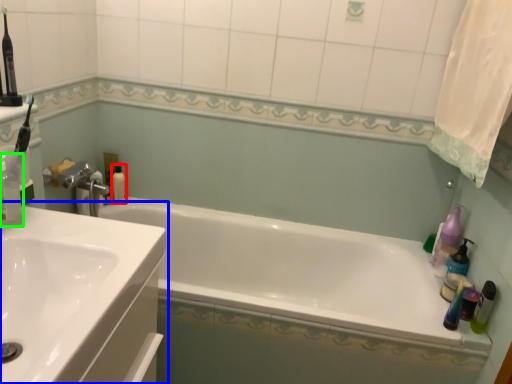
Question: Which object is positioned closest to mouthwash (highlighted by a red box)? Select from sink (highlighted by a blue box) and cleaning product (highlighted by a green box).

Choices:
 (A) sink
 (B) cleaning product

Answer: (B)